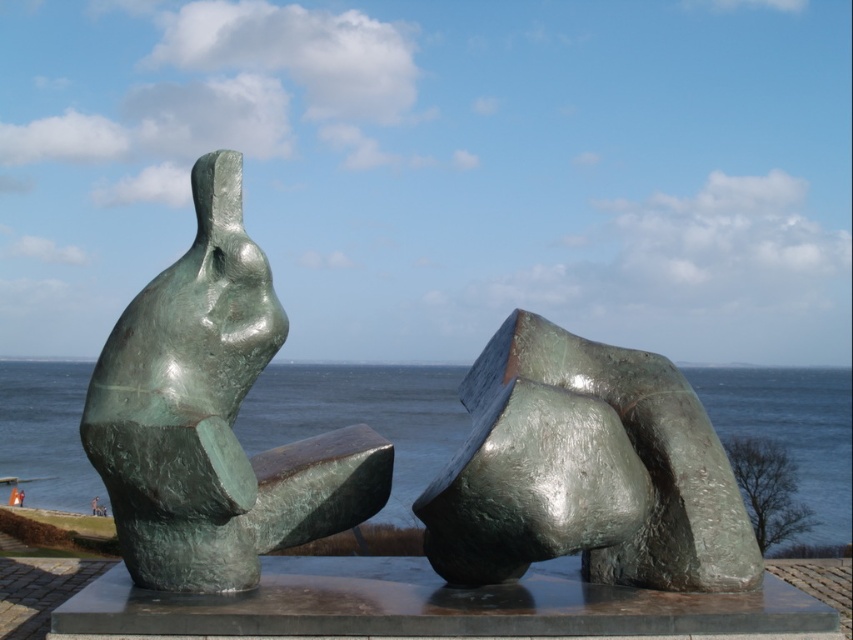
Question: Which of these objects is positioned farthest from the green polished stone abstract form at center?

Choices:
 (A) green polished bronze statue at left
 (B) green metallic water at center

Answer: (B)

Question: Which of these objects is positioned closest to the green polished stone abstract form at center?

Choices:
 (A) green metallic water at center
 (B) green polished bronze statue at left

Answer: (B)

Question: Can you confirm if green polished stone abstract form at center is bigger than green metallic water at center?

Choices:
 (A) yes
 (B) no

Answer: (B)

Question: Is green polished bronze statue at left to the right of green metallic water at center from the viewer's perspective?

Choices:
 (A) yes
 (B) no

Answer: (A)

Question: Which point is closer to the camera?

Choices:
 (A) green polished stone abstract form at center
 (B) green polished bronze statue at left

Answer: (A)

Question: Can you confirm if green polished bronze statue at left is bigger than green polished stone abstract form at center?

Choices:
 (A) yes
 (B) no

Answer: (A)